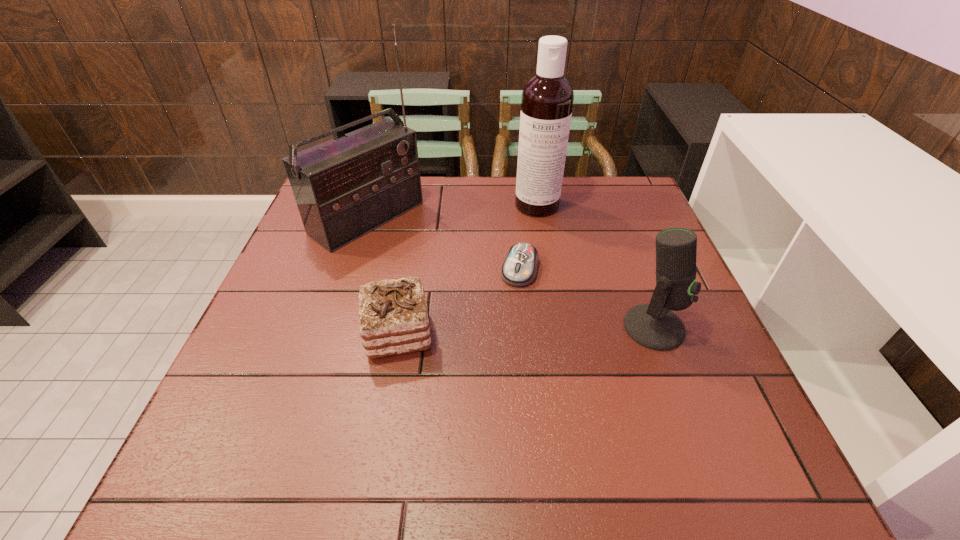
The image size is (960, 540). In order to click on free location located 0.350m on the front panel of the radio receiver in this screenshot , I will do `click(499, 306)`.

Identify the location of vacant position located on the label side of the dishwasher detergent. The width and height of the screenshot is (960, 540). (549, 324).

Where is `vacant point located 0.200m on the label side of the dishwasher detergent`? vacant point located 0.200m on the label side of the dishwasher detergent is located at coordinates (543, 264).

Image resolution: width=960 pixels, height=540 pixels. What are the coordinates of `vacant region located on the label side of the dishwasher detergent` in the screenshot? It's located at (548, 318).

Locate an element on the screen. The height and width of the screenshot is (540, 960). vacant area located on the wheel side of the computer mouse is located at coordinates (474, 421).

Find the location of a particular element. The image size is (960, 540). vacant position located 0.090m on the wheel side of the computer mouse is located at coordinates (508, 314).

This screenshot has height=540, width=960. I want to click on free region located on the wheel side of the computer mouse, so click(x=500, y=338).

Where is `radio receiver that is at the far edge`? The height and width of the screenshot is (540, 960). radio receiver that is at the far edge is located at coordinates (345, 188).

At what (x,y) coordinates should I click in order to perform the action: click on dishwasher detergent situated at the far edge. Please return your answer as a coordinate pair (x, y). The width and height of the screenshot is (960, 540). Looking at the image, I should click on (547, 99).

In order to click on object present at the left edge in this screenshot , I will do `click(345, 188)`.